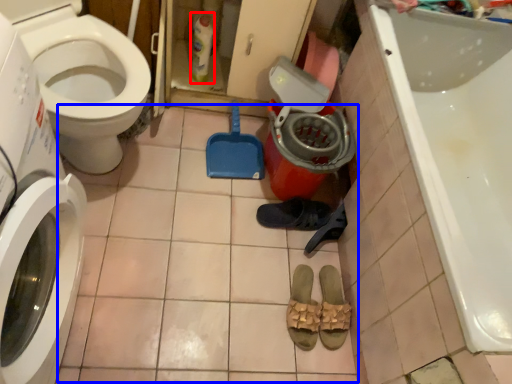
Question: Which object appears farthest to the camera in this image, cleaning product (highlighted by a red box) or tile (highlighted by a blue box)?

Choices:
 (A) cleaning product
 (B) tile

Answer: (A)